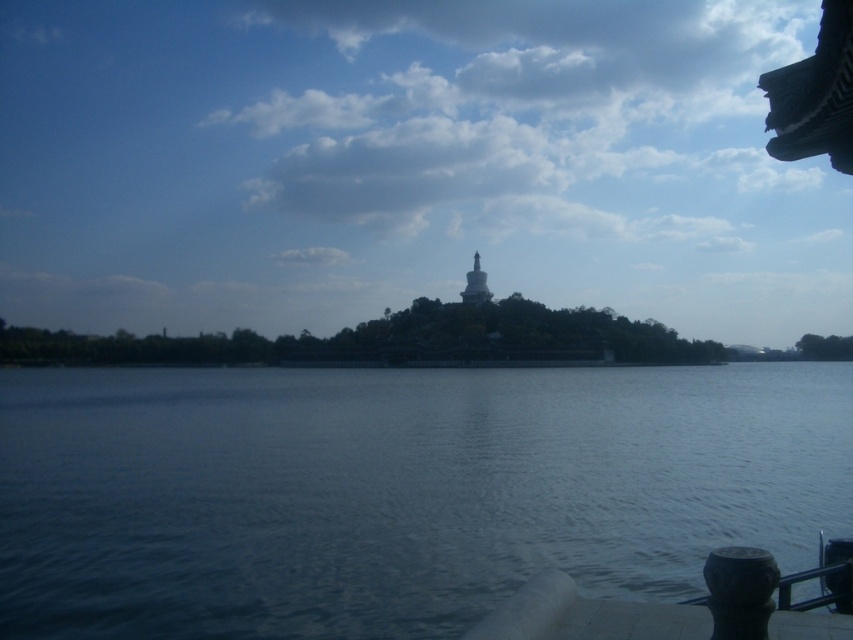
You are a drone operator trying to capture a photo of the white structure atop the green hill. Your drone is currently hovering above the dark blue water at center. To get the best shot, you need to move the drone directly towards the white structure. In which direction should you move the drone from its current position?

The dark blue water at center is located at point (395, 492). To move the drone towards the white structure atop the green hill, you should move it northward.

You are a drone operator trying to locate a specific point on the image. The coordinates given are point [395,492]. Based on the scene, what is the location of this point?

The point [395,492] marks the dark blue water at center.